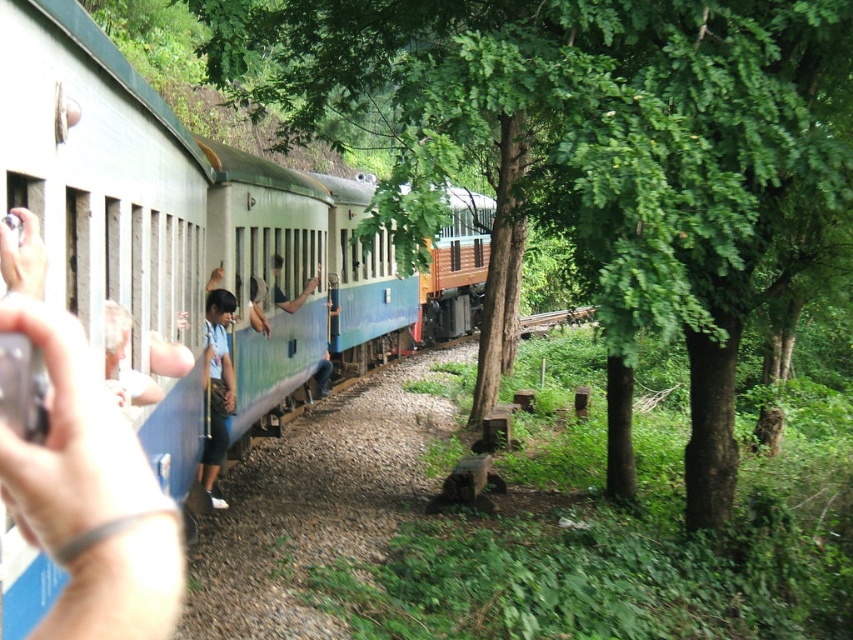
You are a photographer standing near the railway tracks. You want to take a photo of the blue fabric shirt at left and the green leafy tree at center so that both are clearly visible. Which object should you focus on first to ensure proper focus?

The green leafy tree at center is much taller than the blue fabric shirt at left, so you should focus on the green leafy tree at center first to ensure proper focus since it is farther away and requires more depth of field.

You are standing on the railway track and see the blue painted metal train at center and the blue fabric shirt at left. Which object is bigger in size?

The blue painted metal train at center is larger in size compared to the blue fabric shirt at left.

Consider the image. You are a passenger on the train and you look out the window. You see a green leafy tree at center and a blue fabric shirt at left. Which object is higher from your viewpoint?

The green leafy tree at center is above the blue fabric shirt at left from your viewpoint.